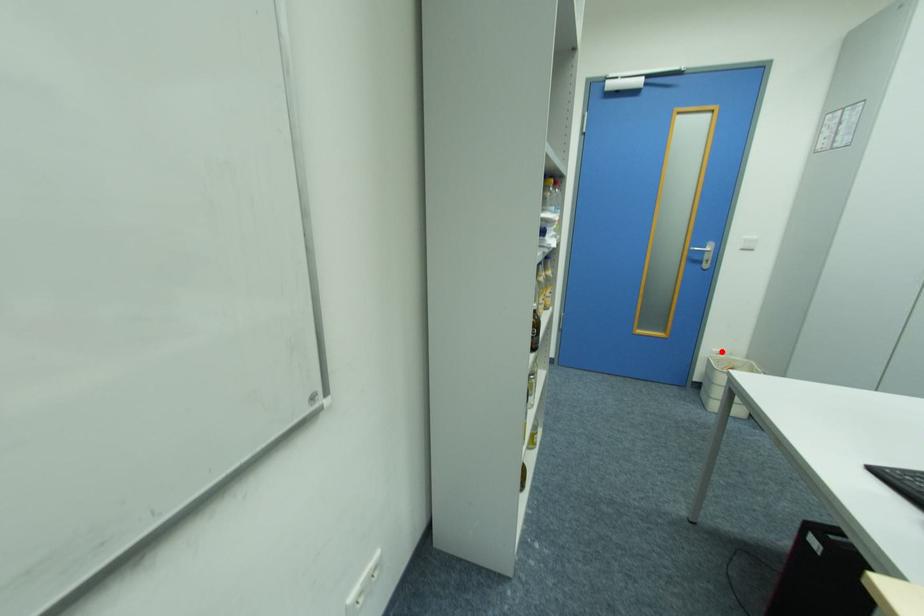
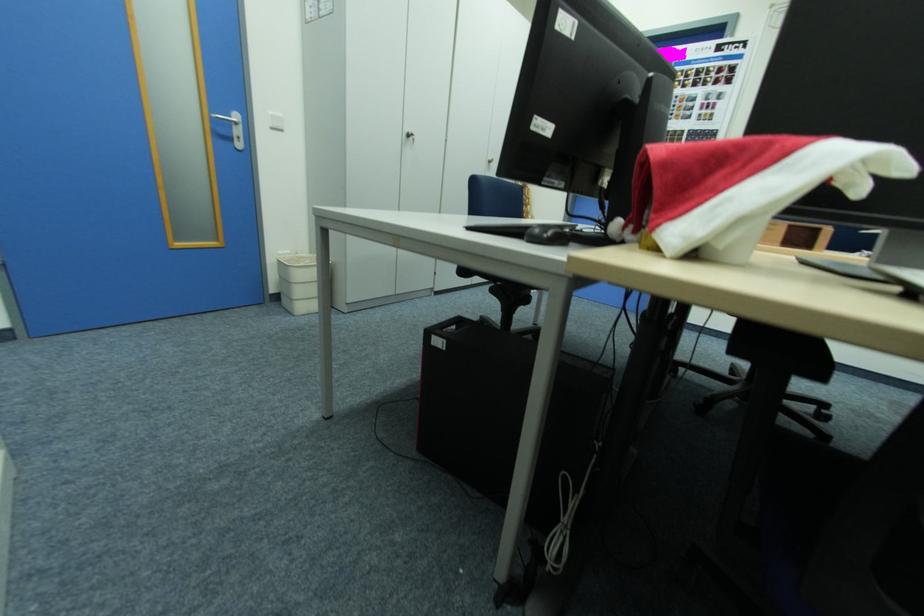
Where in the second image is the point corresponding to the highlighted location from the first image?

(286, 254)